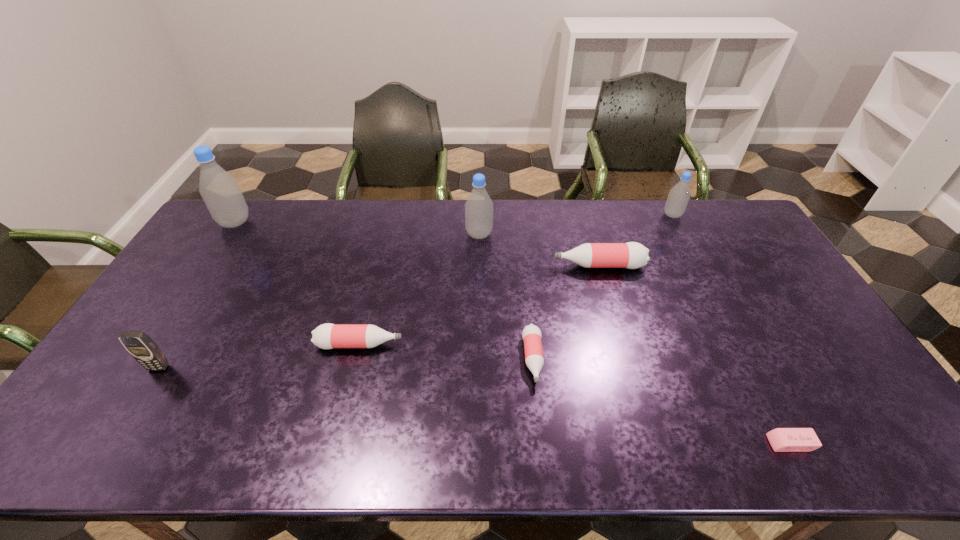
In order to click on free space located with the cap open on the rightmost pink bottle in this screenshot , I will do `click(498, 266)`.

Identify the location of vacant point located 0.200m with the cap open on the rightmost pink bottle. (492, 266).

The height and width of the screenshot is (540, 960). What are the coordinates of `free space located 0.120m with the cap open on the leftmost pink bottle` in the screenshot? It's located at (446, 345).

Locate an element on the screen. free space located with the cap open on the second pink bottle from right to left is located at coordinates (540, 417).

You are a GUI agent. You are given a task and a screenshot of the screen. Output one action in this format:
    pyautogui.click(x=<x>, y=<y>)
    Task: Click on the vacant space located on the back of the eraser
    This screenshot has width=960, height=540.
    Given the screenshot: What is the action you would take?
    pyautogui.click(x=743, y=354)

You are a GUI agent. You are given a task and a screenshot of the screen. Output one action in this format:
    pyautogui.click(x=<x>, y=<y>)
    Task: Click on the object that is at the near edge
    The height and width of the screenshot is (540, 960).
    Given the screenshot: What is the action you would take?
    pyautogui.click(x=781, y=439)

Where is `bottle located at the left edge`? The width and height of the screenshot is (960, 540). bottle located at the left edge is located at coordinates (220, 191).

Where is `cellular telephone located at the left edge`? cellular telephone located at the left edge is located at coordinates (144, 350).

Find the location of a particular element. This screenshot has width=960, height=540. object located in the far left corner section of the desktop is located at coordinates 220,191.

In the image, there is a desktop. In order to click on free space at the far edge in this screenshot , I will do `click(424, 233)`.